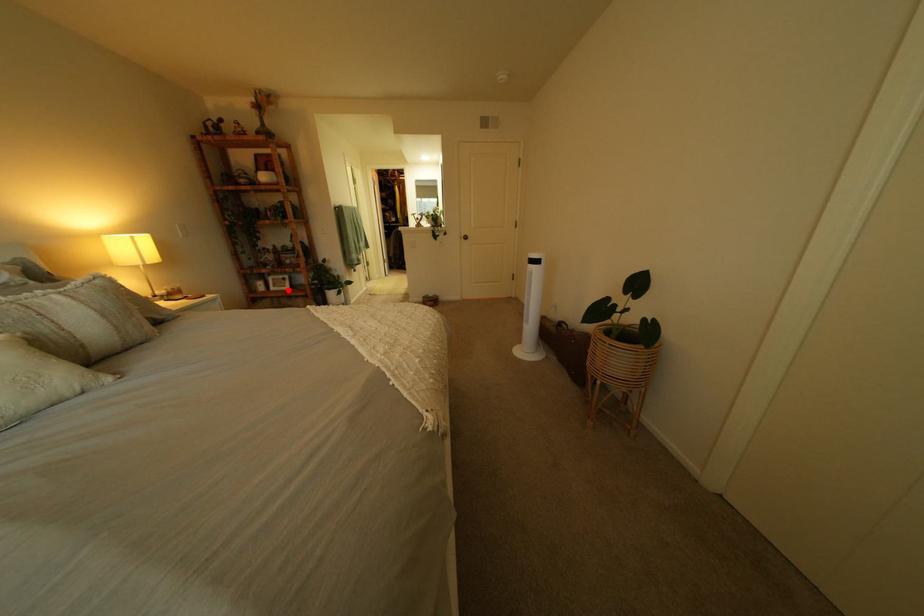
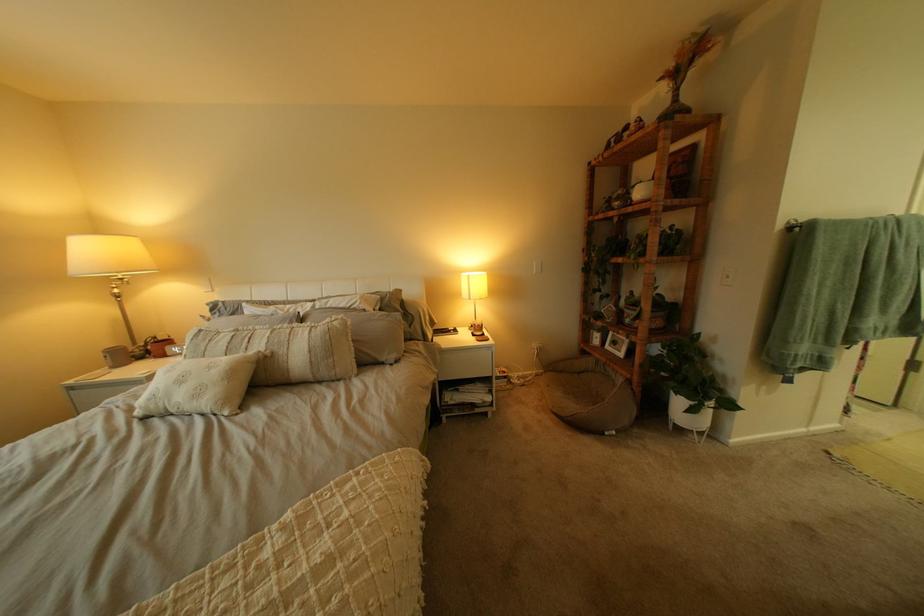
Question: I am providing you with two images of the same scene from different viewpoints. Image1 has a red point marked. In image2, the corresponding 3D location appears at what relative position? Reply with the corresponding letter.

Choices:
 (A) Closer
 (B) Farther

Answer: (B)